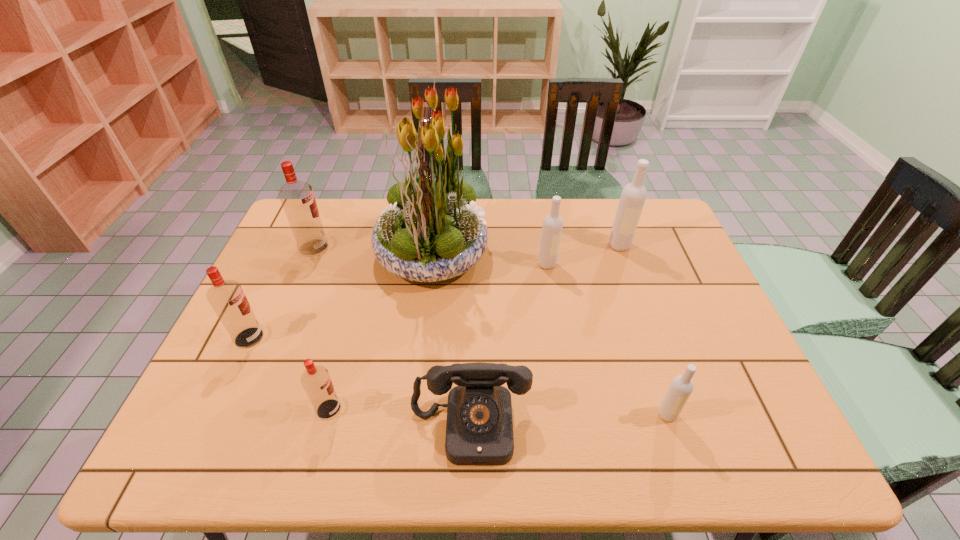
You are a GUI agent. You are given a task and a screenshot of the screen. Output one action in this format:
    pyautogui.click(x=<x>, y=<y>)
    Task: Click on the shortest object
    
    Given the screenshot: What is the action you would take?
    pyautogui.click(x=479, y=430)

What are the coordinates of `gray telephone` in the screenshot? It's located at (479, 430).

Locate an element on the screen. vacant space located on the front-facing side of the tallest object is located at coordinates (520, 253).

You are a GUI agent. You are given a task and a screenshot of the screen. Output one action in this format:
    pyautogui.click(x=<x>, y=<y>)
    Task: Click on the blank space located on the front label of the biggest red vodka
    This screenshot has width=960, height=540.
    Given the screenshot: What is the action you would take?
    pyautogui.click(x=357, y=248)

Identify the location of free region located 0.150m on the left of the biggest white vodka. (562, 245).

The image size is (960, 540). Identify the location of vacant region located on the back of the second smallest white vodka. (537, 199).

Locate an element on the screen. The height and width of the screenshot is (540, 960). free region located 0.290m on the front label of the second nearest red vodka is located at coordinates (375, 338).

You are a GUI agent. You are given a task and a screenshot of the screen. Output one action in this format:
    pyautogui.click(x=<x>, y=<y>)
    Task: Click on the free point located 0.360m on the front label of the nearest red vodka
    
    Given the screenshot: What is the action you would take?
    pyautogui.click(x=501, y=409)

Locate an element on the screen. This screenshot has width=960, height=540. free space located 0.070m on the left of the nearest white vodka is located at coordinates (626, 414).

What are the coordinates of `flower arrangement present at the far edge` in the screenshot? It's located at (432, 230).